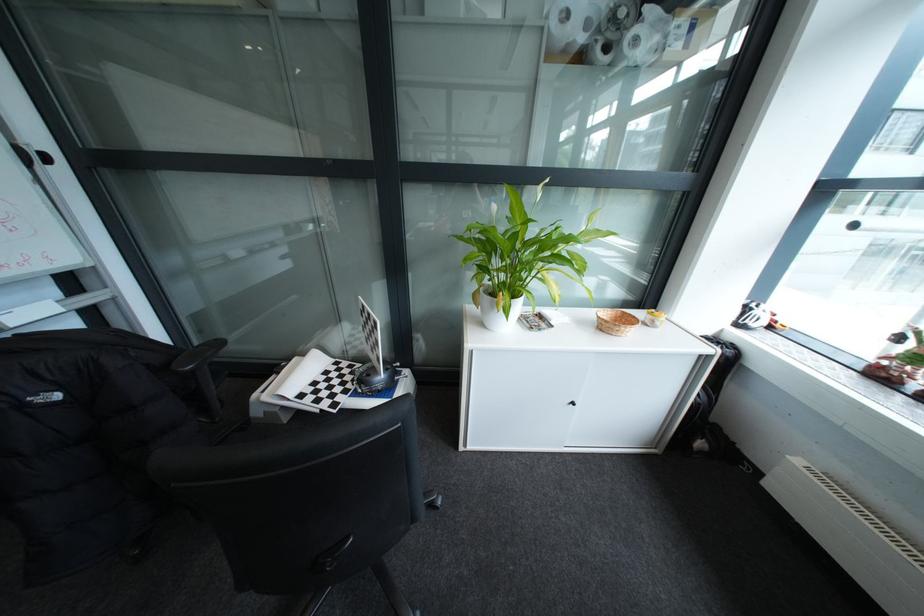
Where would you lift the small wicker basket? Please return your answer as a coordinate pair (x, y).

(614, 322)